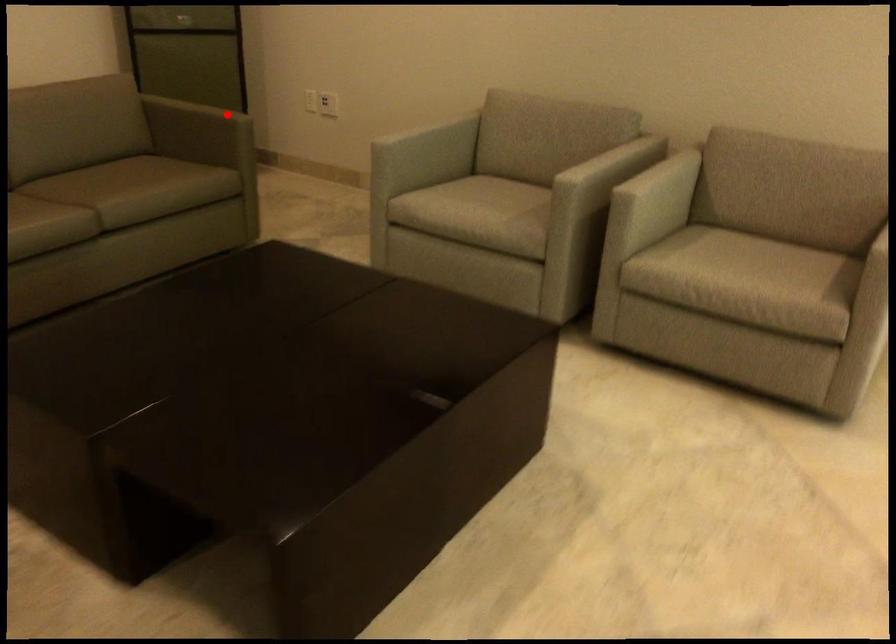
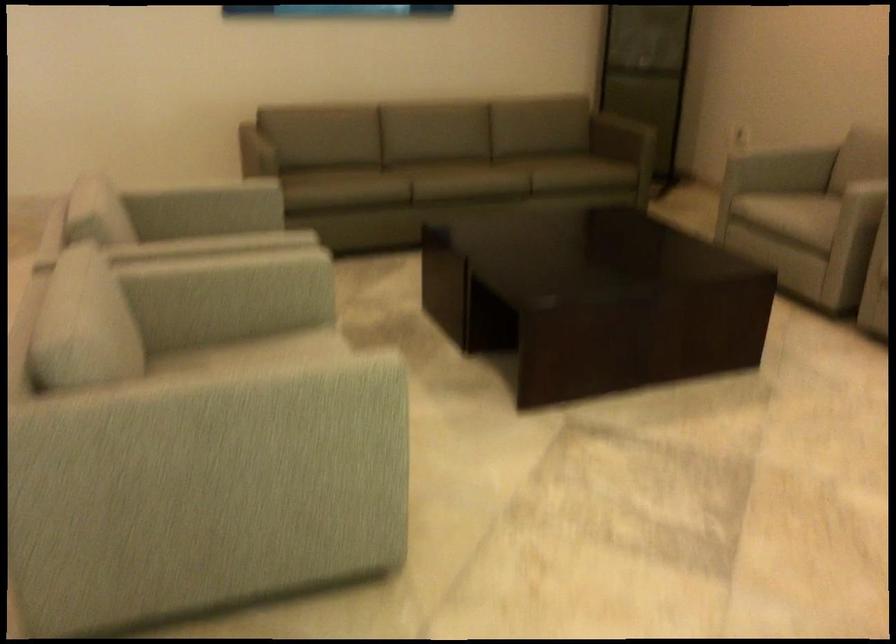
Locate, in the second image, the point that corresponds to the highlighted location in the first image.

(648, 140)